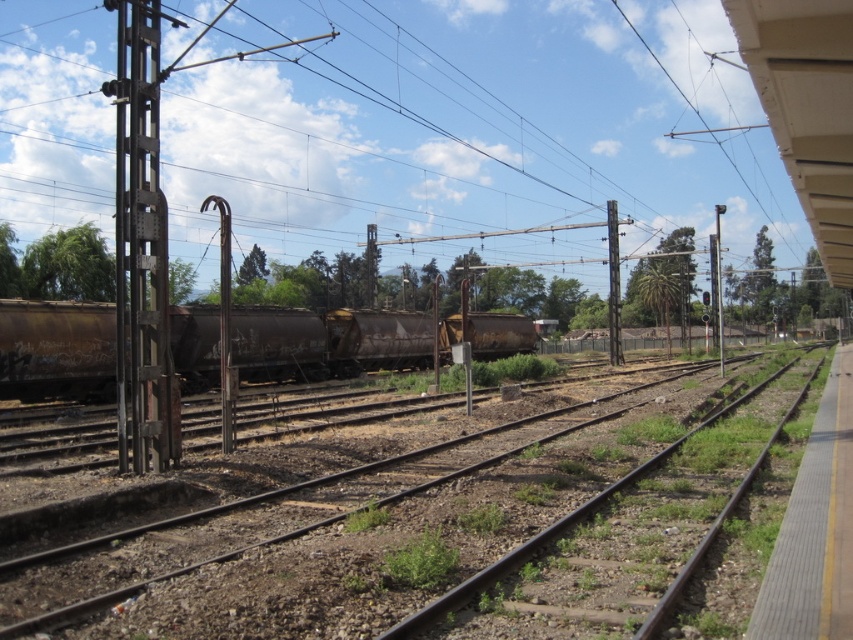
You are a maintenance worker inspecting the railway yard. You notice two metallic poles supporting the overhead wires. Which pole, the metallic gray pole at left or the metallic pole at center, requires more wire to connect to the same overhead point?

The metallic pole at center requires more wire to connect to the same overhead point because it is taller than the metallic gray pole at left.